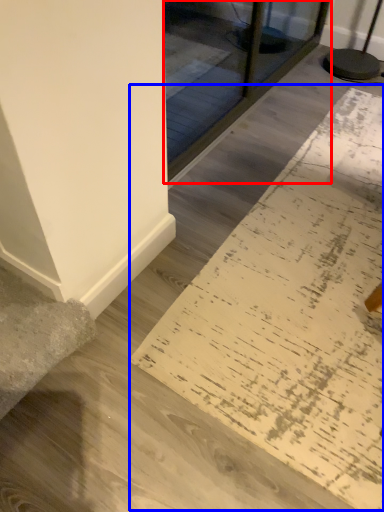
Question: Which object is closer to the camera taking this photo, glass door (highlighted by a red box) or doormat (highlighted by a blue box)?

Choices:
 (A) glass door
 (B) doormat

Answer: (B)